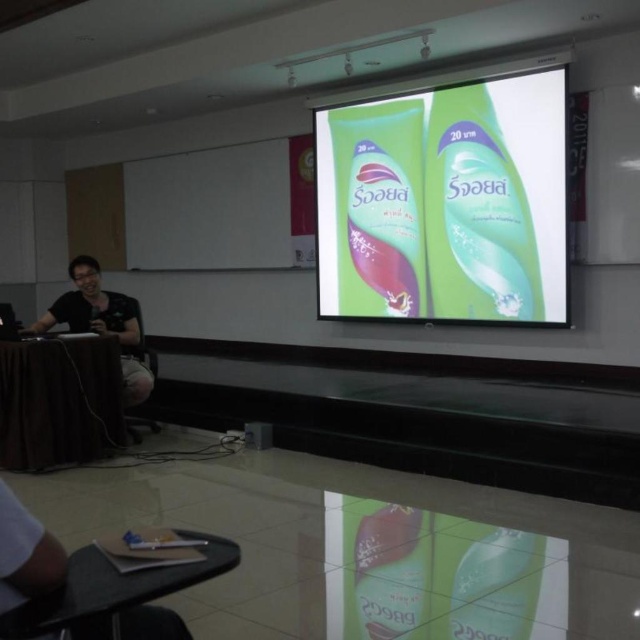
You are an attendee at the presentation and notice two black items on the left side of the room. Which one is positioned further to the left between the black fabric table at left and the black matte shirt at left?

The black fabric table at left is positioned further to the left compared to the black matte shirt at left, as it is located to the left of the shirt.

You are sitting in the classroom and want to place your matte brown notebook at lower left on the black fabric table at left. Can you reach it without moving from your seat?

The black fabric table at left is further to the viewer than the matte brown notebook at lower left, so you can reach it without moving from your seat because the notebook is closer to you than the table.

You are organizing a classroom activity and need to place a large poster on the wall. The poster is the size of the green plastic tubes at center. Will it fit on the black fabric table at left if you lay it flat?

The green plastic tubes at center is bigger than black fabric table at left, so the poster will not fit on the black fabric table at left when laid flat.